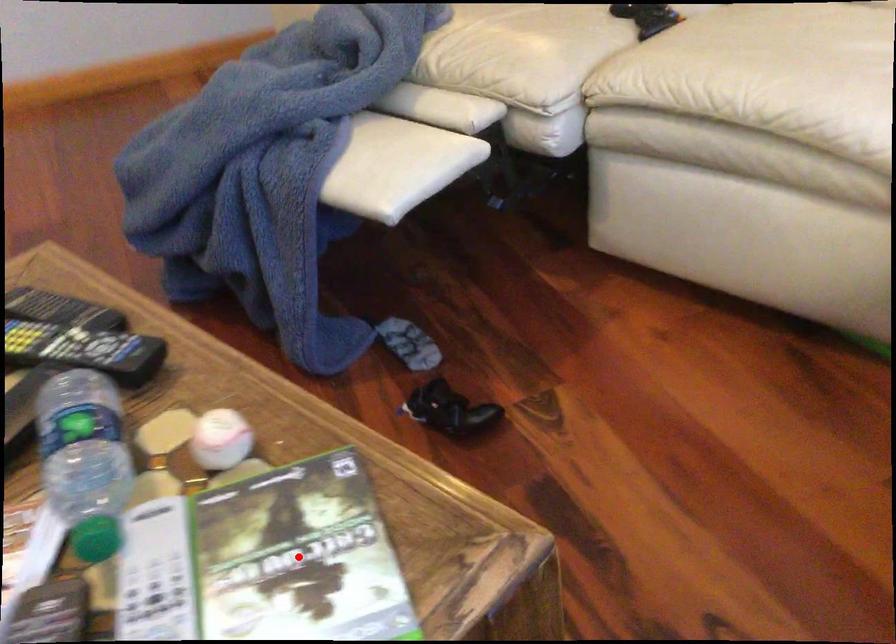
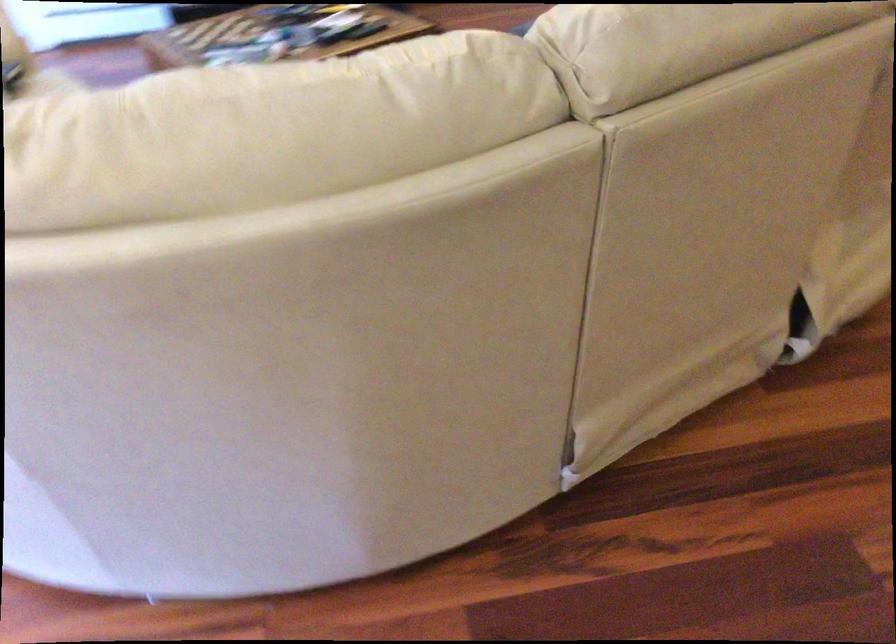
Question: I am providing you with two images of the same scene from different viewpoints. A red point is marked on the first image. Can you still see the location of the red point in image 2?

Choices:
 (A) Yes
 (B) No

Answer: (B)